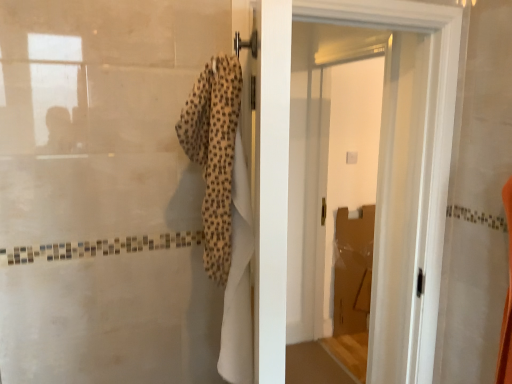
Question: Can you confirm if beige textured towel at center is thinner than white glossy door at upper center?

Choices:
 (A) yes
 (B) no

Answer: (A)

Question: Does beige textured towel at center have a greater height compared to white glossy door at upper center?

Choices:
 (A) no
 (B) yes

Answer: (A)

Question: Is beige textured towel at center wider than white glossy door at upper center?

Choices:
 (A) yes
 (B) no

Answer: (B)

Question: Is the position of beige textured towel at center more distant than that of white glossy door at upper center?

Choices:
 (A) no
 (B) yes

Answer: (A)

Question: From a real-world perspective, is beige textured towel at center located beneath white glossy door at upper center?

Choices:
 (A) no
 (B) yes

Answer: (A)

Question: In the image, is beige textured towel at center positioned in front of or behind white glossy door at upper center?

Choices:
 (A) behind
 (B) front

Answer: (B)

Question: Looking at their shapes, would you say beige textured towel at center is wider or thinner than white glossy door at upper center?

Choices:
 (A) thin
 (B) wide

Answer: (A)

Question: From the image's perspective, relative to white glossy door at upper center, is beige textured towel at center above or below?

Choices:
 (A) below
 (B) above

Answer: (B)

Question: Visually, is beige textured towel at center positioned to the left or to the right of white glossy door at upper center?

Choices:
 (A) right
 (B) left

Answer: (B)

Question: Choose the correct answer: Is white glossy door at center inside beige textured towel at center or outside it?

Choices:
 (A) outside
 (B) inside

Answer: (A)

Question: Considering the positions of white glossy door at center and beige textured towel at center in the image, is white glossy door at center bigger or smaller than beige textured towel at center?

Choices:
 (A) big
 (B) small

Answer: (A)

Question: Looking at their shapes, would you say white glossy door at center is wider or thinner than beige textured towel at center?

Choices:
 (A) thin
 (B) wide

Answer: (A)

Question: Is point (263, 216) closer or farther from the camera than point (183, 132)?

Choices:
 (A) closer
 (B) farther

Answer: (A)

Question: Considering the positions of beige textured towel at center and white glossy door at center in the image, is beige textured towel at center wider or thinner than white glossy door at center?

Choices:
 (A) wide
 (B) thin

Answer: (A)

Question: Looking at the image, does beige textured towel at center seem bigger or smaller compared to white glossy door at center?

Choices:
 (A) small
 (B) big

Answer: (A)